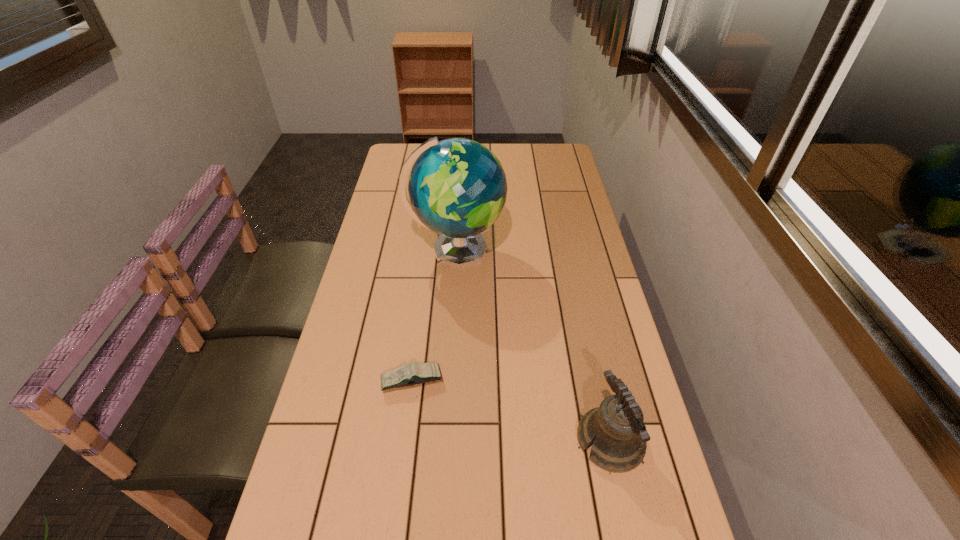
You are a GUI agent. You are given a task and a screenshot of the screen. Output one action in this format:
    pyautogui.click(x=<x>, y=<y>)
    Task: Click on the vacant area that lies between the tallest object and the diary
    This screenshot has width=960, height=540.
    Given the screenshot: What is the action you would take?
    pyautogui.click(x=434, y=315)

At what (x,y) coordinates should I click in order to perform the action: click on object that is the closest to the bell. Please return your answer as a coordinate pair (x, y). The image size is (960, 540). Looking at the image, I should click on (415, 373).

At what (x,y) coordinates should I click in order to perform the action: click on the second closest object to the bell. Please return your answer as a coordinate pair (x, y). The image size is (960, 540). Looking at the image, I should click on (457, 187).

I want to click on free spot that satisfies the following two spatial constraints: 1. on the front side of the second shortest object; 2. on the left side of the shortest object, so click(404, 441).

Find the location of a particular element. This screenshot has height=540, width=960. vacant area in the image that satisfies the following two spatial constraints: 1. on the front side of the diary; 2. on the left side of the nearest object is located at coordinates (404, 441).